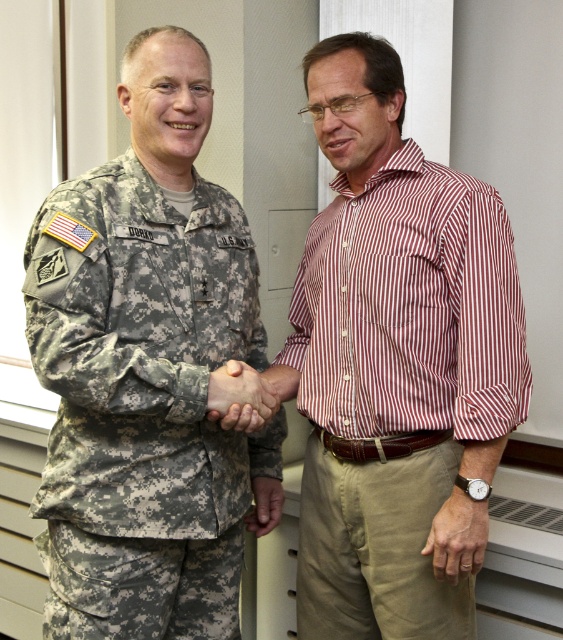
Which is more to the left, striped cotton shirt at center or camouflage fabric uniform at left?

From the viewer's perspective, camouflage fabric uniform at left appears more on the left side.

Does striped cotton shirt at center come in front of camouflage fabric uniform at left?

No, it is behind camouflage fabric uniform at left.

Is point (372, 116) less distant than point (172, 465)?

No, it is behind (172, 465).

Identify the location of striped cotton shirt at center. (396, 365).

Between striped cotton shirt at center and camouflage fabric hand at center, which one has more height?

With more height is striped cotton shirt at center.

Does striped cotton shirt at center come in front of camouflage fabric hand at center?

Yes, striped cotton shirt at center is in front of camouflage fabric hand at center.

The width and height of the screenshot is (563, 640). What do you see at coordinates (396, 365) in the screenshot?
I see `striped cotton shirt at center` at bounding box center [396, 365].

Identify the location of striped cotton shirt at center. The width and height of the screenshot is (563, 640). (396, 365).

Does camouflage fabric uniform at left have a greater height compared to camouflage fabric hand at center?

Indeed, camouflage fabric uniform at left has a greater height compared to camouflage fabric hand at center.

This screenshot has width=563, height=640. In order to click on camouflage fabric uniform at left in this screenshot , I will do `click(142, 404)`.

Which is behind, point (92, 384) or point (215, 401)?

Positioned behind is point (215, 401).

Locate an element on the screen. The height and width of the screenshot is (640, 563). camouflage fabric uniform at left is located at coordinates (142, 404).